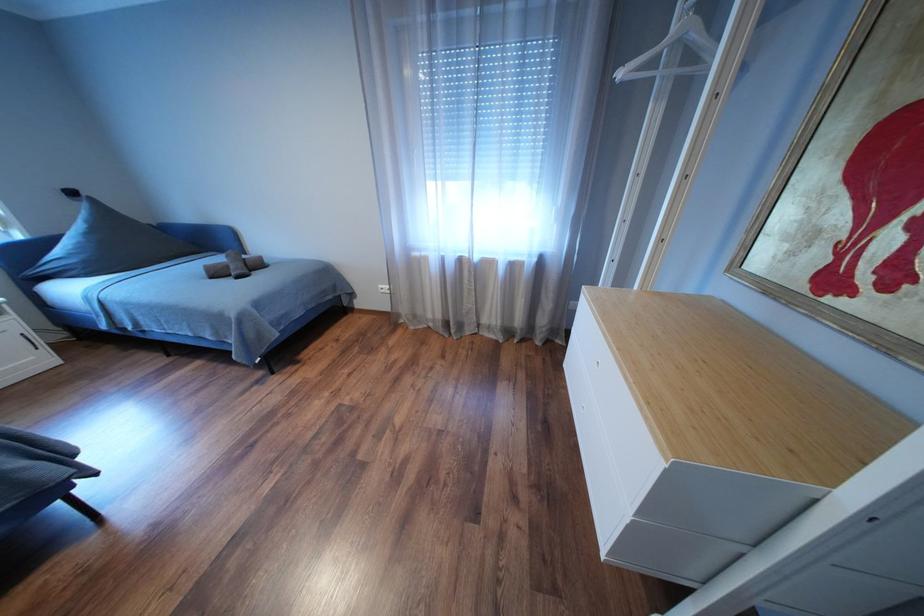
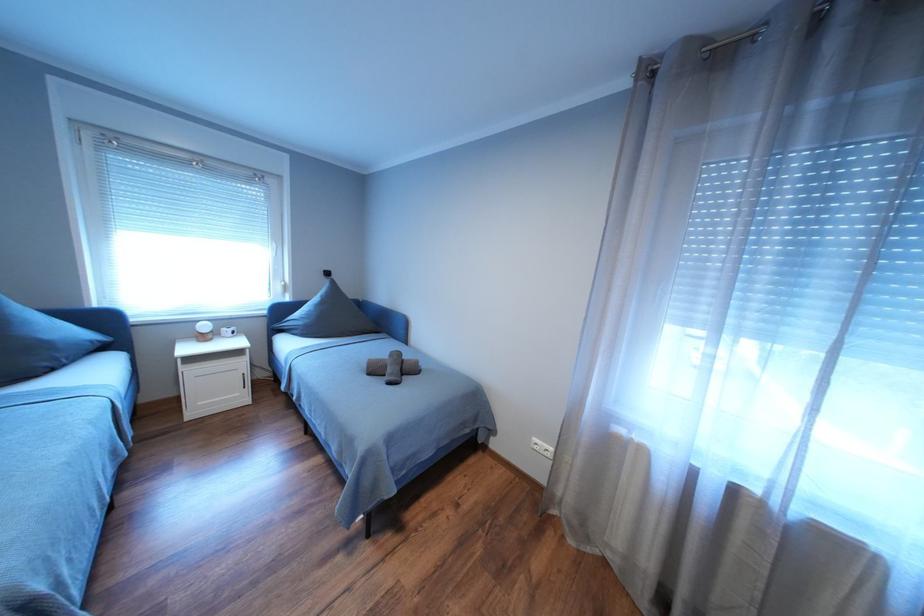
Question: The camera is either moving clockwise (left) or counter-clockwise (right) around the object. The first image is from the beginning of the video and the second image is from the end. Is the camera moving left or right when shooting the video?

Choices:
 (A) Left
 (B) Right

Answer: (B)